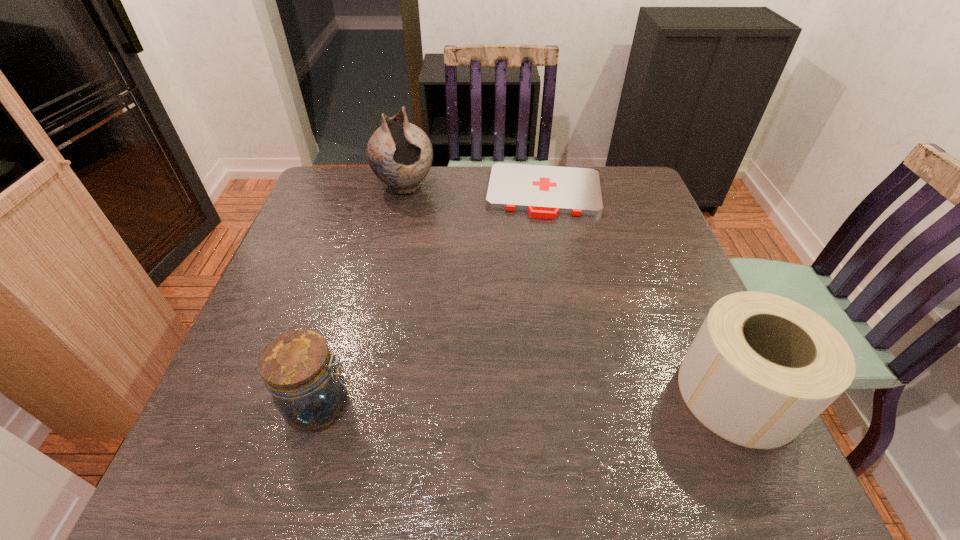
Identify the location of vacant space situated on handle side the third object from left to right. The image size is (960, 540). pos(538,319).

Locate an element on the screen. The height and width of the screenshot is (540, 960). free point located on handle side the third object from left to right is located at coordinates (540, 232).

Where is `vacant space located 0.200m on handle side the third object from left to right`? The height and width of the screenshot is (540, 960). vacant space located 0.200m on handle side the third object from left to right is located at coordinates (540, 267).

Where is `pottery located at the far edge`? The width and height of the screenshot is (960, 540). pottery located at the far edge is located at coordinates (400, 154).

I want to click on the first-aid kit situated at the far edge, so (544, 191).

Locate an element on the screen. jar that is positioned at the near edge is located at coordinates (298, 369).

The width and height of the screenshot is (960, 540). I want to click on toilet tissue present at the near edge, so click(762, 367).

Identify the location of object that is at the left edge. This screenshot has width=960, height=540. (298, 369).

Where is `toilet tissue at the right edge`? The width and height of the screenshot is (960, 540). toilet tissue at the right edge is located at coordinates [x=762, y=367].

Locate an element on the screen. the first-aid kit located at the right edge is located at coordinates (544, 191).